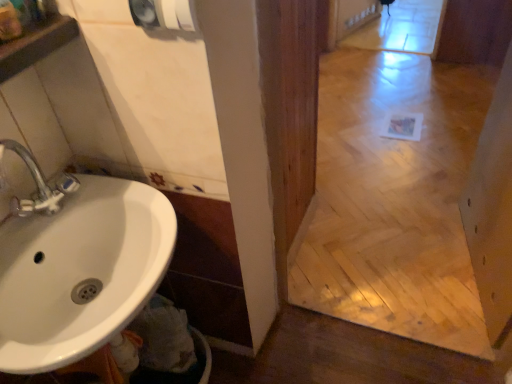
Question: Are white glossy sink at lower left and matte gray hand dryer at upper center making contact?

Choices:
 (A) no
 (B) yes

Answer: (A)

Question: Can you confirm if white glossy sink at lower left is bigger than matte gray hand dryer at upper center?

Choices:
 (A) no
 (B) yes

Answer: (B)

Question: Is white glossy sink at lower left oriented towards matte gray hand dryer at upper center?

Choices:
 (A) no
 (B) yes

Answer: (A)

Question: From a real-world perspective, is white glossy sink at lower left on matte gray hand dryer at upper center?

Choices:
 (A) yes
 (B) no

Answer: (B)

Question: Is white glossy sink at lower left to the right of matte gray hand dryer at upper center from the viewer's perspective?

Choices:
 (A) no
 (B) yes

Answer: (A)

Question: Is white glossy sink at lower left at the left side of matte gray hand dryer at upper center?

Choices:
 (A) yes
 (B) no

Answer: (A)

Question: Is matte gray hand dryer at upper center smaller than white glossy sink at lower left?

Choices:
 (A) no
 (B) yes

Answer: (B)

Question: Is matte gray hand dryer at upper center outside white glossy sink at lower left?

Choices:
 (A) no
 (B) yes

Answer: (B)

Question: Is matte gray hand dryer at upper center not close to white glossy sink at lower left?

Choices:
 (A) yes
 (B) no

Answer: (B)

Question: Is matte gray hand dryer at upper center wider than white glossy sink at lower left?

Choices:
 (A) no
 (B) yes

Answer: (A)

Question: Is matte gray hand dryer at upper center further to the viewer compared to white glossy sink at lower left?

Choices:
 (A) yes
 (B) no

Answer: (A)

Question: Is matte gray hand dryer at upper center at the left side of white glossy sink at lower left?

Choices:
 (A) yes
 (B) no

Answer: (B)

Question: From a real-world perspective, is matte gray hand dryer at upper center physically located above or below white glossy sink at lower left?

Choices:
 (A) above
 (B) below

Answer: (A)